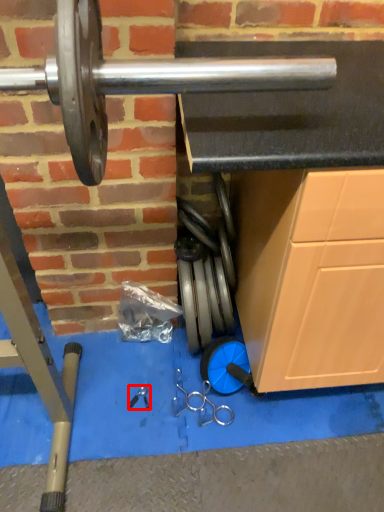
Question: From the image's perspective, what is the correct spatial relationship of tool (annotated by the red box) in relation to tool?

Choices:
 (A) above
 (B) below

Answer: (B)